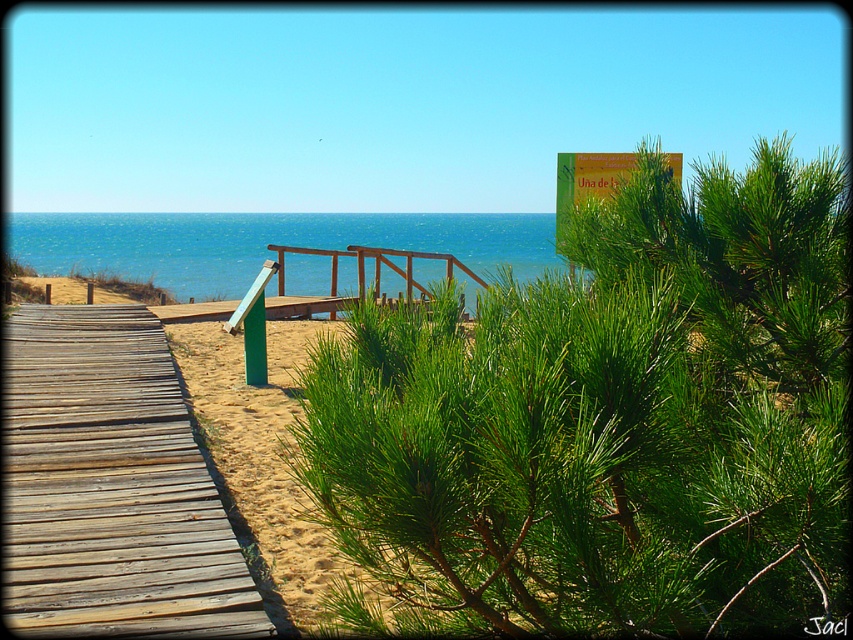
Based on the photo, you are a tourist standing on the boardwalk and want to read the yellow paper sign at upper center. Since the blue water at center is in the way, can you move around it to get a clear view of the sign?

The blue water at center is larger than the yellow paper sign at upper center, so you can move around the blue water at center to get a clear view of the yellow paper sign at upper center.

You are a tourist standing on the wooden boardwalk and want to read the yellow paper sign at upper center. However, the wooden rail at center might be blocking your view. Based on their sizes, can you tell which one is smaller and thus easier to see around?

The yellow paper sign at upper center is smaller than the wooden rail at center, so it might be easier to see around the wooden rail at center.

From the picture: You are standing on the weathered wood boardwalk at lower left and want to see the blue water at center. Which direction should you move to get a better view?

The blue water at center is behind the weathered wood boardwalk at lower left, so you should move forward along the boardwalk to get a better view.